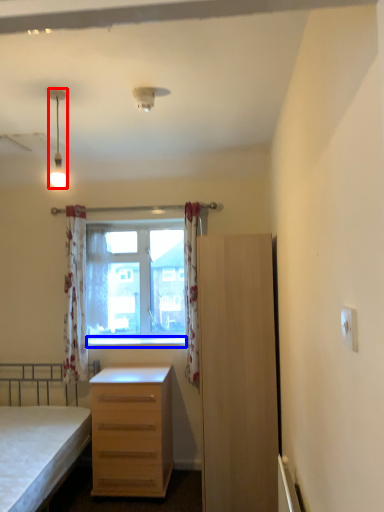
Question: Which point is further to the camera, lamp (highlighted by a red box) or window sill (highlighted by a blue box)?

Choices:
 (A) lamp
 (B) window sill

Answer: (B)